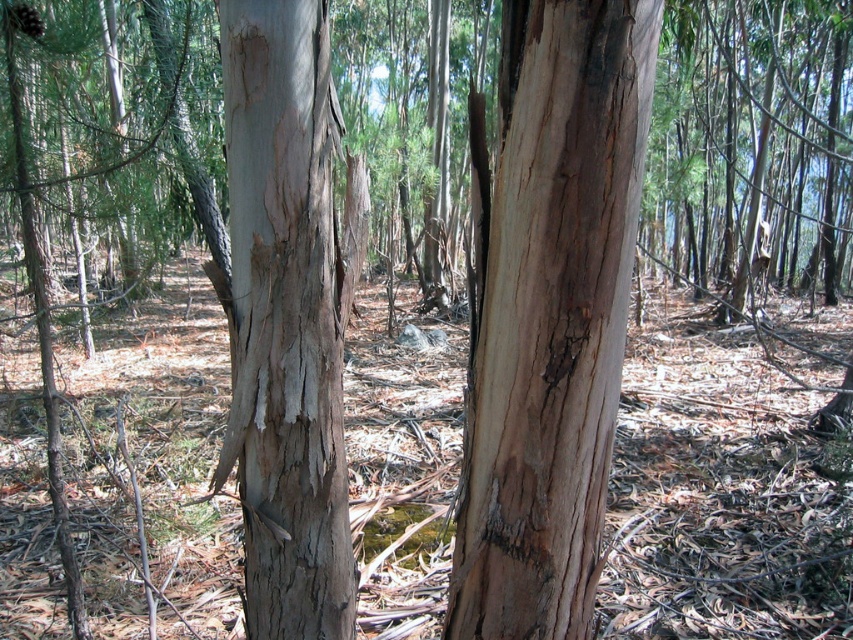
Who is higher up, light brown bark at center or light brown rough bark at center?

Positioned higher is light brown rough bark at center.

Does light brown bark at center have a smaller size compared to light brown rough bark at center?

Indeed, light brown bark at center has a smaller size compared to light brown rough bark at center.

Measure the distance between point (x=599, y=452) and camera.

Point (x=599, y=452) and camera are 1.16 meters apart.

At what (x,y) coordinates should I click in order to perform the action: click on light brown bark at center. Please return your answer as a coordinate pair (x, y). Looking at the image, I should click on (550, 314).